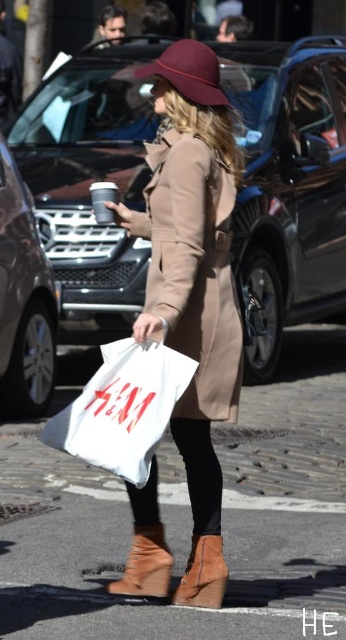
You are a pedestrian trying to cross the street safely. You see a shiny black car at center and a tan leather trench coat at center. Which object is closer to the sidewalk?

The tan leather trench coat at center is closer to the sidewalk because the shiny black car at center is positioned to its right side, meaning the car is further away from the sidewalk compared to the coat.

Consider the image. You are standing at the point marked by the coordinate point at point (149, 564). You want to walk to the nearest coffee shop located 4.08 meters away. Is there enough space to walk straight to the coffee shop without any obstacles?

Yes, there is enough space to walk straight to the coffee shop located 4.08 meters away from the point (149, 564) since the distance between them is exactly 4.08 meters with no obstacles mentioned in the scene description.